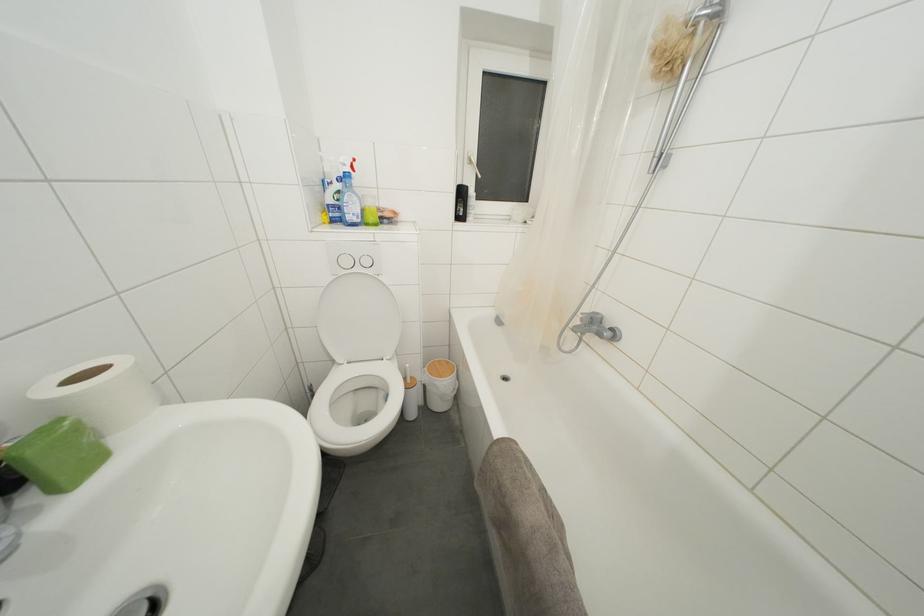
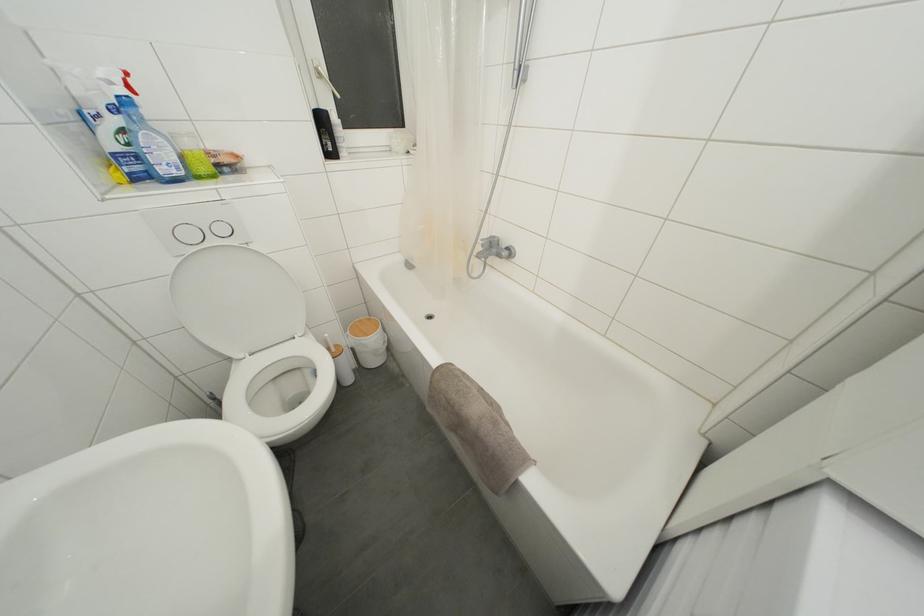
The point at (373, 208) is marked in the first image. Where is the corresponding point in the second image?

(193, 148)